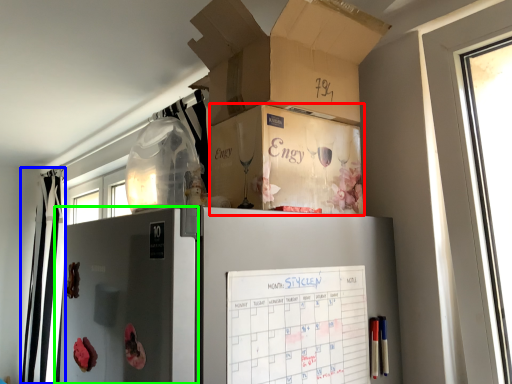
Question: Which is nearer to the storage box (highlighted by a red box)? curtain (highlighted by a blue box) or screen door (highlighted by a green box).

Choices:
 (A) curtain
 (B) screen door

Answer: (B)